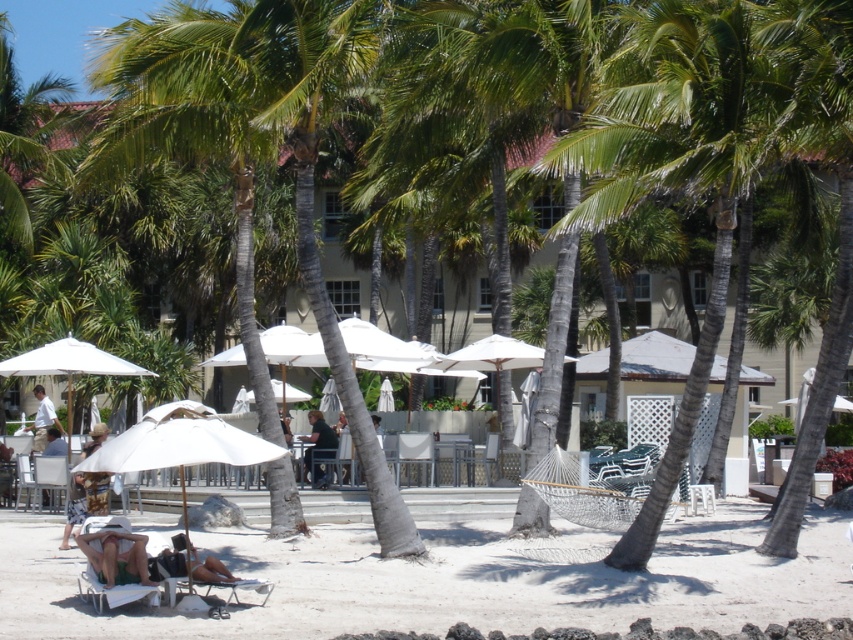
You are a guest at the resort and want to know if you can place your beach bag on the beige fabric beach chair at lower left without it falling off. Considering the height of the white shirt at center, can you determine if the chair is tall enough to support the bag?

The beige fabric beach chair at lower left is shorter than the white shirt at center. Since the chair is shorter than the shirt, it might not provide enough height to securely place the bag without it slipping off.

From the picture: You are a guest at the resort and want to know if you can see the beach chair from under the umbrella. Are you able to see the beige fabric beach chair at lower left while standing under the white matte umbrella at lower left?

The white matte umbrella at lower left is taller than the beige fabric beach chair at lower left, so yes, you can see the beige fabric beach chair at lower left from under the umbrella because the umbrella is taller and does not block the view.